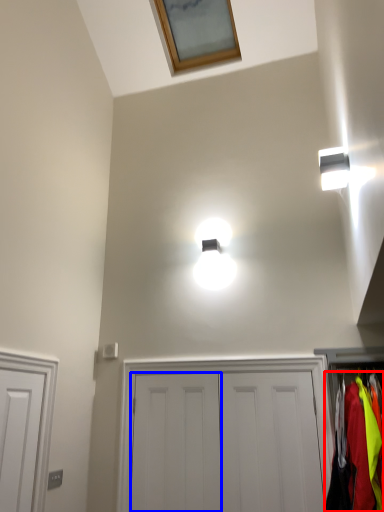
Question: Which object appears closest to the camera in this image, clothing (highlighted by a red box) or door (highlighted by a blue box)?

Choices:
 (A) clothing
 (B) door

Answer: (A)